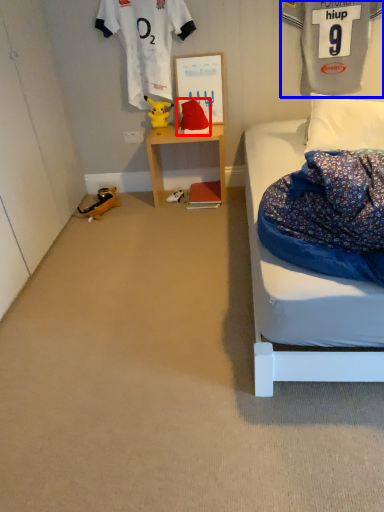
Question: Which object appears closest to the camera in this image, toy (highlighted by a red box) or clothing (highlighted by a blue box)?

Choices:
 (A) toy
 (B) clothing

Answer: (B)